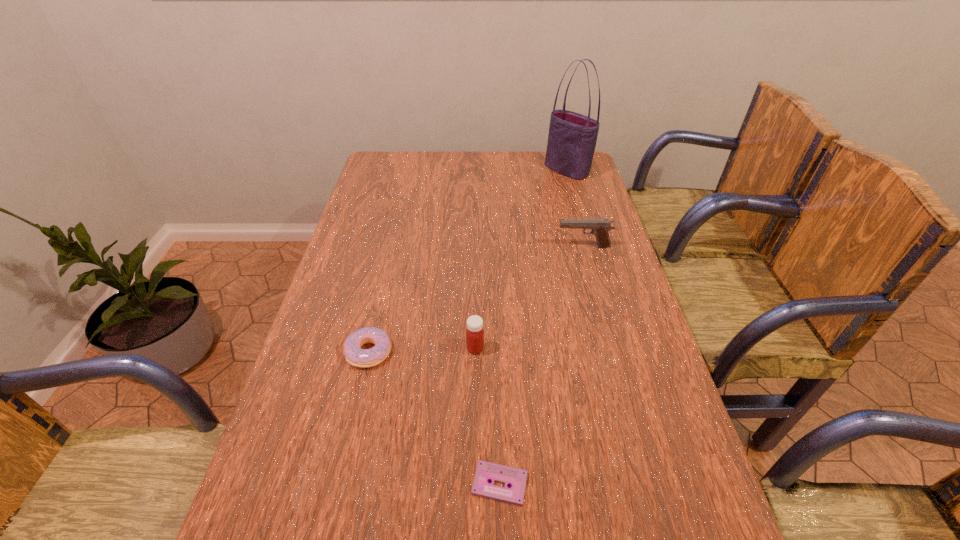
Where is `free space located 0.360m at the barrel of the pistol`? free space located 0.360m at the barrel of the pistol is located at coordinates (439, 247).

This screenshot has width=960, height=540. In order to click on vacant region located at the barrel of the pistol in this screenshot , I will do `click(534, 247)`.

This screenshot has height=540, width=960. I want to click on vacant space located on the back of the medicine, so click(476, 240).

Find the location of a particular element. The image size is (960, 540). free space located on the front of the fourth tallest object is located at coordinates (339, 487).

Find the location of `free point located 0.110m on the back of the nearest object`. free point located 0.110m on the back of the nearest object is located at coordinates (497, 411).

You are a GUI agent. You are given a task and a screenshot of the screen. Output one action in this format:
    pyautogui.click(x=<x>, y=<y>)
    Task: Click on the object that is at the far edge
    The image size is (960, 540).
    Given the screenshot: What is the action you would take?
    pyautogui.click(x=572, y=137)

Where is `object that is at the left edge`? object that is at the left edge is located at coordinates (356, 356).

The width and height of the screenshot is (960, 540). What are the coordinates of `tote bag that is at the right edge` in the screenshot? It's located at (572, 137).

This screenshot has width=960, height=540. Find the location of `pistol positioned at the right edge`. pistol positioned at the right edge is located at coordinates (599, 227).

Image resolution: width=960 pixels, height=540 pixels. I want to click on object that is at the far right corner, so click(x=572, y=137).